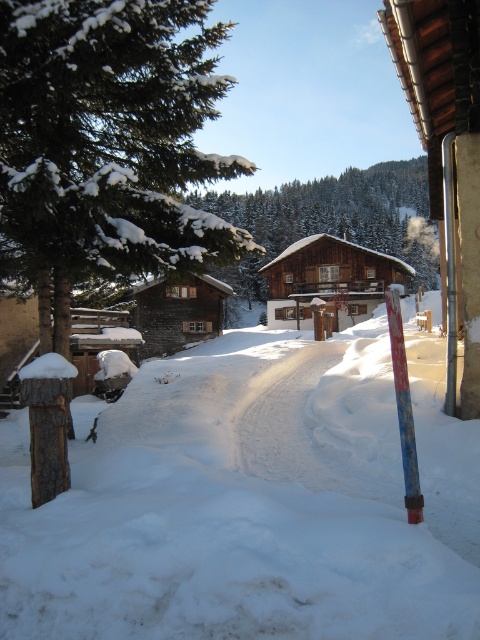
From the picture: You are standing at the point marked by the coordinates point (328, 280) in the winter scene. What object are you directly in front of?

The point (328, 280) indicates wooden cabin at center, so you are directly in front of the wooden cabin at center.